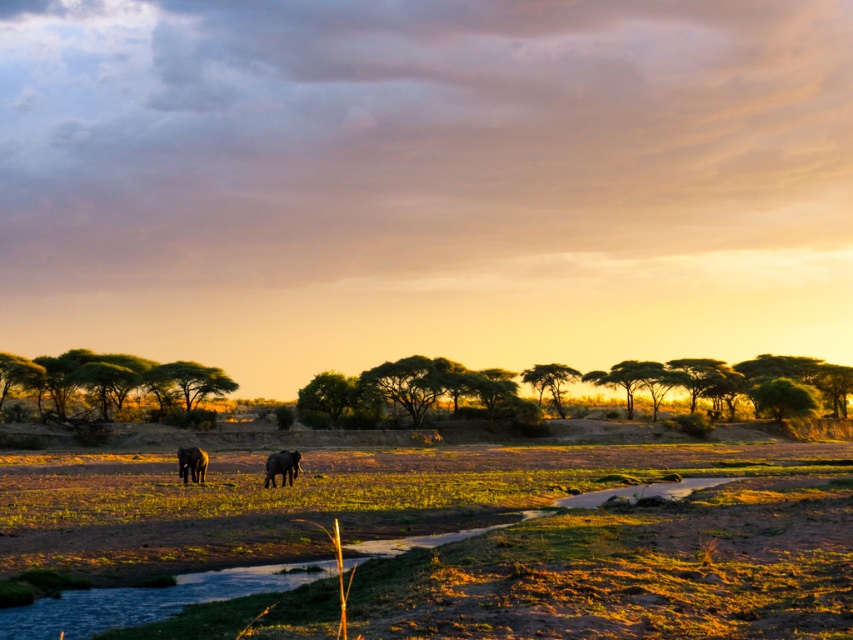
Question: Considering the relative positions of dark gray textured elephant at center and grayish-brown textured elephant at lower left in the image provided, where is dark gray textured elephant at center located with respect to grayish-brown textured elephant at lower left?

Choices:
 (A) below
 (B) above

Answer: (B)

Question: Does dark gray textured elephant at center have a lesser width compared to grayish-brown textured elephant at lower left?

Choices:
 (A) yes
 (B) no

Answer: (A)

Question: Which of the following is the farthest from the observer?

Choices:
 (A) (282, 474)
 (B) (184, 454)

Answer: (B)

Question: Considering the relative positions of dark gray textured elephant at center and grayish-brown textured elephant at lower left in the image provided, where is dark gray textured elephant at center located with respect to grayish-brown textured elephant at lower left?

Choices:
 (A) above
 (B) below

Answer: (A)

Question: Which point appears closest to the camera in this image?

Choices:
 (A) (x=291, y=470)
 (B) (x=186, y=448)

Answer: (A)